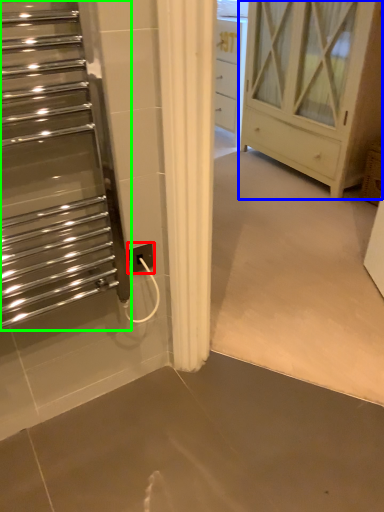
Question: Which object is positioned farthest from electric outlet (highlighted by a red box)? Select from chest of drawers (highlighted by a blue box) and escalator (highlighted by a green box).

Choices:
 (A) chest of drawers
 (B) escalator

Answer: (A)